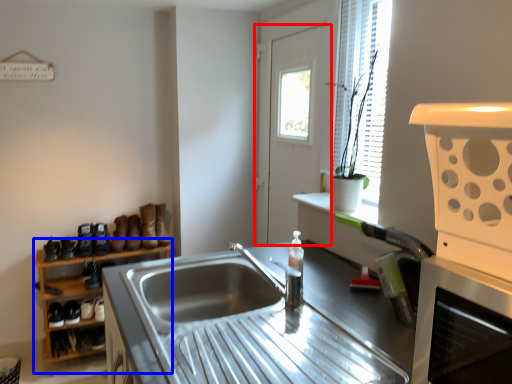
Question: Among these objects, which one is nearest to the camera, door (highlighted by a red box) or shelf (highlighted by a blue box)?

Choices:
 (A) door
 (B) shelf

Answer: (A)